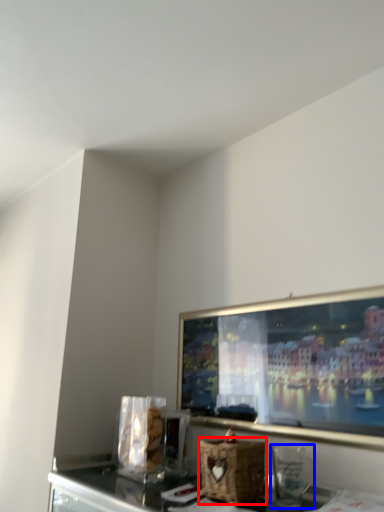
Question: Which point is closer to the camera, basket (highlighted by a red box) or appliance (highlighted by a blue box)?

Choices:
 (A) basket
 (B) appliance

Answer: (B)